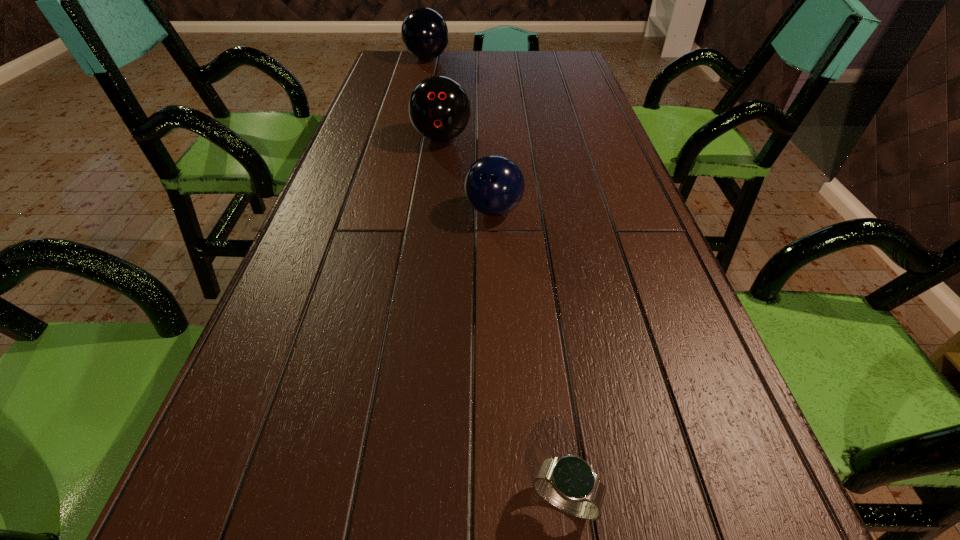
Locate an element on the screen. This screenshot has width=960, height=540. object that is at the far edge is located at coordinates (424, 32).

Where is `object that is positioned at the left edge`? This screenshot has width=960, height=540. object that is positioned at the left edge is located at coordinates (424, 32).

Identify the location of object at the far left corner. The width and height of the screenshot is (960, 540). (424, 32).

In order to click on vacant area at the left edge of the desktop in this screenshot , I will do `click(319, 221)`.

You are a GUI agent. You are given a task and a screenshot of the screen. Output one action in this format:
    pyautogui.click(x=<x>, y=<y>)
    Task: Click on the vacant space at the right edge of the desktop
    The width and height of the screenshot is (960, 540).
    Given the screenshot: What is the action you would take?
    pyautogui.click(x=572, y=82)

Where is `free space at the far left corner of the desktop`? The height and width of the screenshot is (540, 960). free space at the far left corner of the desktop is located at coordinates (403, 55).

At what (x,y) coordinates should I click in order to perform the action: click on vacant space at the far right corner of the desktop. Please return your answer as a coordinate pair (x, y). The image size is (960, 540). Looking at the image, I should click on (556, 66).

Find the location of a particular element. free spot between the third tallest object and the farthest bowling ball is located at coordinates (460, 135).

Image resolution: width=960 pixels, height=540 pixels. I want to click on vacant point located between the third tallest object and the shortest object, so click(x=529, y=356).

The height and width of the screenshot is (540, 960). Identify the location of free space between the farthest bowling ball and the third farthest object. (460, 135).